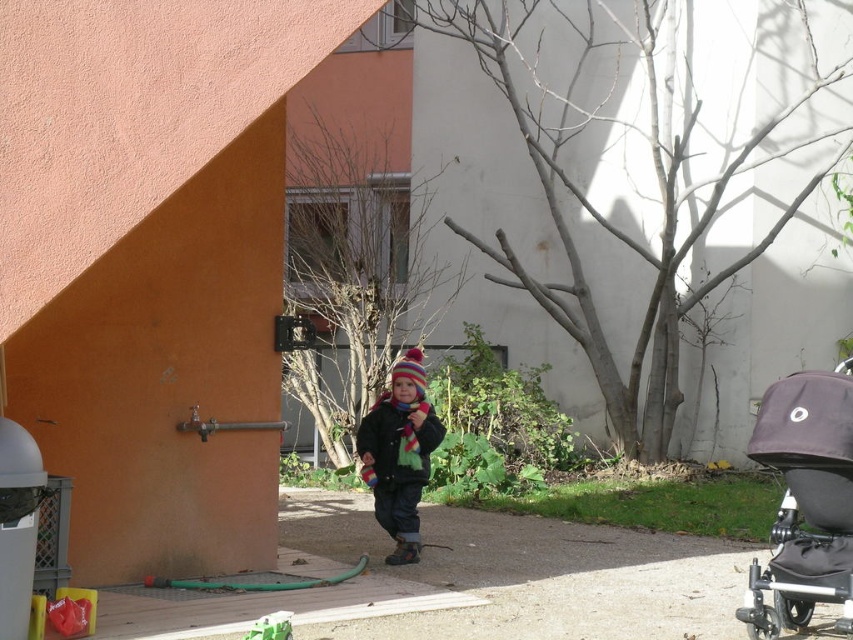
Question: Which object appears farthest from the camera in this image?

Choices:
 (A) striped woolen hat at center
 (B) dark gray fabric stroller at lower right

Answer: (A)

Question: Is dark gray fabric stroller at lower right thinner than striped woolen hat at center?

Choices:
 (A) yes
 (B) no

Answer: (B)

Question: Which of the following is the closest to the observer?

Choices:
 (A) striped woolen hat at center
 (B) dark gray fabric stroller at lower right

Answer: (B)

Question: Is dark gray fabric stroller at lower right behind striped woolen hat at center?

Choices:
 (A) yes
 (B) no

Answer: (B)

Question: Can you confirm if dark gray fabric stroller at lower right is positioned to the right of striped woolen hat at center?

Choices:
 (A) yes
 (B) no

Answer: (A)

Question: Which of the following is the closest to the observer?

Choices:
 (A) striped woolen hat at center
 (B) dark gray fabric stroller at lower right

Answer: (B)